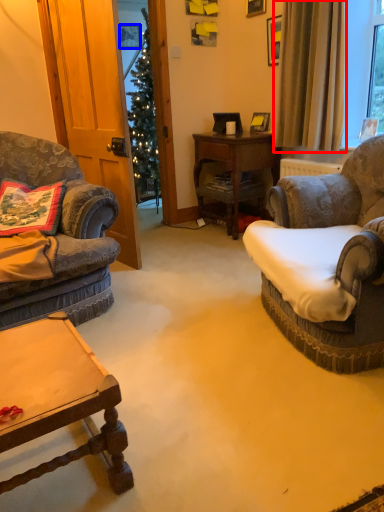
Question: Which object appears farthest to the camera in this image, curtain (highlighted by a red box) or picture frame (highlighted by a blue box)?

Choices:
 (A) curtain
 (B) picture frame

Answer: (B)